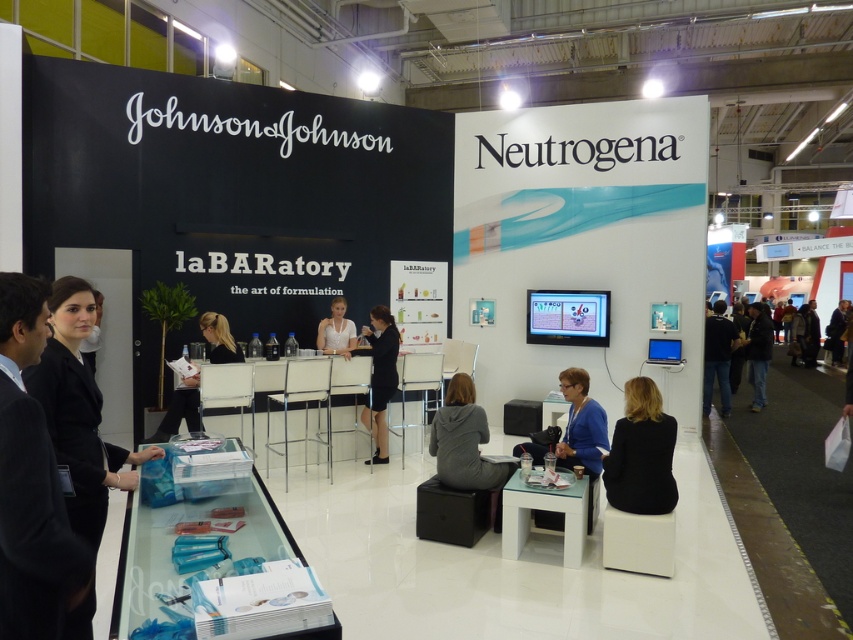
Can you confirm if black fabric coat at lower right is wider than dark blue jeans at lower right?

No.

Does black fabric coat at lower right appear under dark blue jeans at lower right?

Yes.

Is point (630, 488) positioned before point (753, 333)?

Yes, it is in front of point (753, 333).

This screenshot has width=853, height=640. In order to click on black fabric coat at lower right in this screenshot , I will do `click(641, 452)`.

Is blue fabric jacket at lower center below white matte shirt at center?

Yes.

Between point (563, 371) and point (322, 326), which one is positioned in front?

Positioned in front is point (563, 371).

I want to click on blue fabric jacket at lower center, so click(582, 433).

From the picture: Is black fabric at left to the right of blonde hair at center from the viewer's perspective?

Indeed, black fabric at left is positioned on the right side of blonde hair at center.

This screenshot has width=853, height=640. Find the location of `black fabric at left`. black fabric at left is located at coordinates (78, 412).